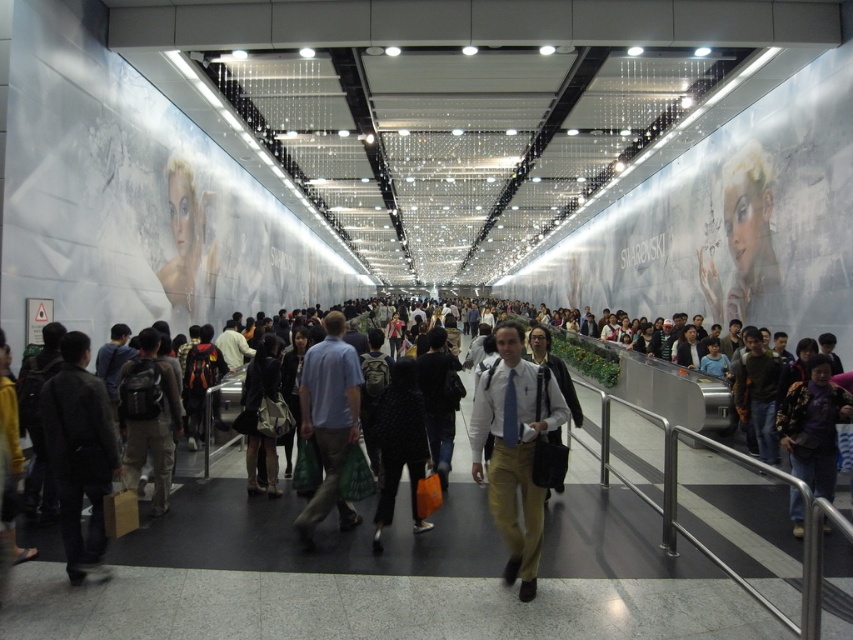
Which is more to the right, light brown cotton pants at center or black dotted sweater at center?

light brown cotton pants at center is more to the right.

Is point (492, 451) closer to camera compared to point (386, 444)?

Yes, it is.

Is point (515, 365) closer to camera compared to point (407, 378)?

Yes.

Locate an element on the screen. This screenshot has height=640, width=853. light brown cotton pants at center is located at coordinates pyautogui.click(x=514, y=449).

Image resolution: width=853 pixels, height=640 pixels. I want to click on dark gray jacket at center, so click(x=79, y=452).

Where is `dark gray jacket at center`? dark gray jacket at center is located at coordinates (79, 452).

Between light blue cotton shirt at center and dark purple fabric jacket at center, which one is positioned higher?

Positioned higher is light blue cotton shirt at center.

Image resolution: width=853 pixels, height=640 pixels. What are the coordinates of `light blue cotton shirt at center` in the screenshot? It's located at (329, 420).